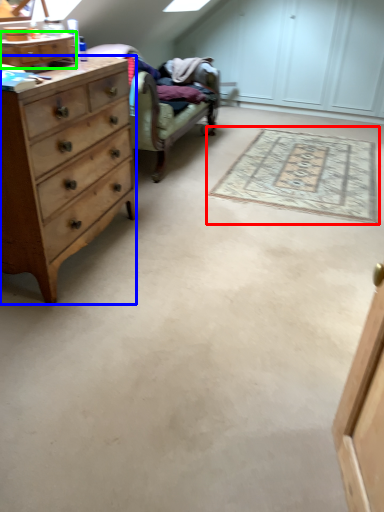
Question: Based on their relative distances, which object is farther from mat (highlighted by a red box)? Choose from chest of drawers (highlighted by a blue box) and cabinetry (highlighted by a green box).

Choices:
 (A) chest of drawers
 (B) cabinetry

Answer: (B)